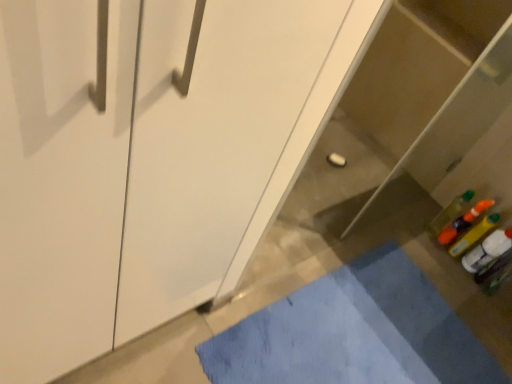
Question: Is translucent plastic bottle at lower right further to the viewer compared to white glossy cabinet at center?

Choices:
 (A) yes
 (B) no

Answer: (A)

Question: From a real-world perspective, is translucent plastic bottle at lower right on top of white glossy cabinet at center?

Choices:
 (A) no
 (B) yes

Answer: (A)

Question: Is white glossy cabinet at center inside translucent plastic bottle at lower right?

Choices:
 (A) yes
 (B) no

Answer: (B)

Question: From a real-world perspective, is translucent plastic bottle at lower right located beneath white glossy cabinet at center?

Choices:
 (A) yes
 (B) no

Answer: (A)

Question: Is translucent plastic bottle at lower right with white glossy cabinet at center?

Choices:
 (A) yes
 (B) no

Answer: (B)

Question: Is translucent plastic bottle at lower right wider than white glossy cabinet at center?

Choices:
 (A) no
 (B) yes

Answer: (B)

Question: Is blue fabric bath mat at lower center aimed at white glossy cabinet at center?

Choices:
 (A) no
 (B) yes

Answer: (A)

Question: From a real-world perspective, is blue fabric bath mat at lower center below white glossy cabinet at center?

Choices:
 (A) yes
 (B) no

Answer: (A)

Question: Considering the relative sizes of blue fabric bath mat at lower center and white glossy cabinet at center in the image provided, is blue fabric bath mat at lower center shorter than white glossy cabinet at center?

Choices:
 (A) yes
 (B) no

Answer: (A)

Question: Is blue fabric bath mat at lower center wider than white glossy cabinet at center?

Choices:
 (A) yes
 (B) no

Answer: (A)

Question: Considering the relative sizes of blue fabric bath mat at lower center and white glossy cabinet at center in the image provided, is blue fabric bath mat at lower center smaller than white glossy cabinet at center?

Choices:
 (A) no
 (B) yes

Answer: (B)

Question: From a real-world perspective, is blue fabric bath mat at lower center positioned over white glossy cabinet at center based on gravity?

Choices:
 (A) no
 (B) yes

Answer: (A)

Question: From a real-world perspective, is white glossy cabinet at center on top of blue fabric bath mat at lower center?

Choices:
 (A) no
 (B) yes

Answer: (B)